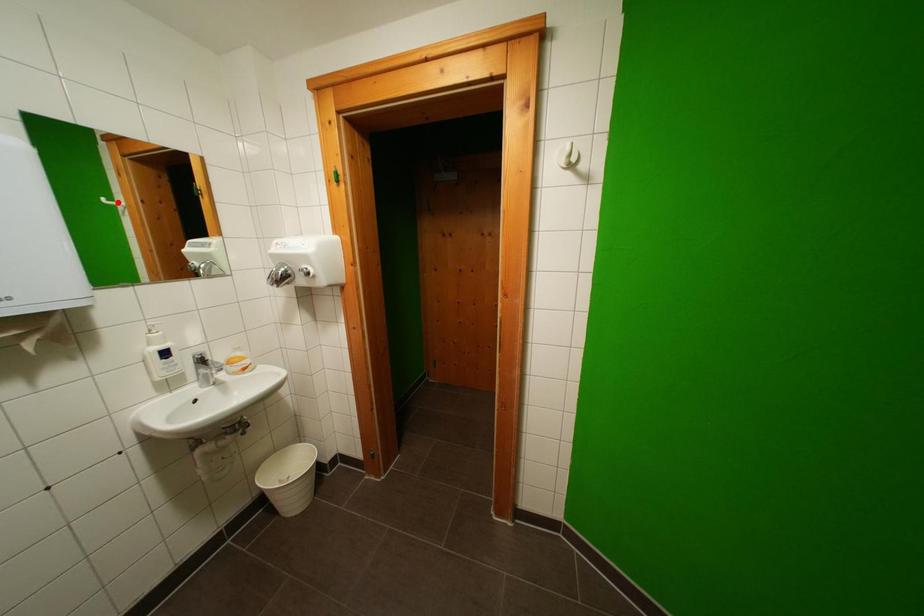
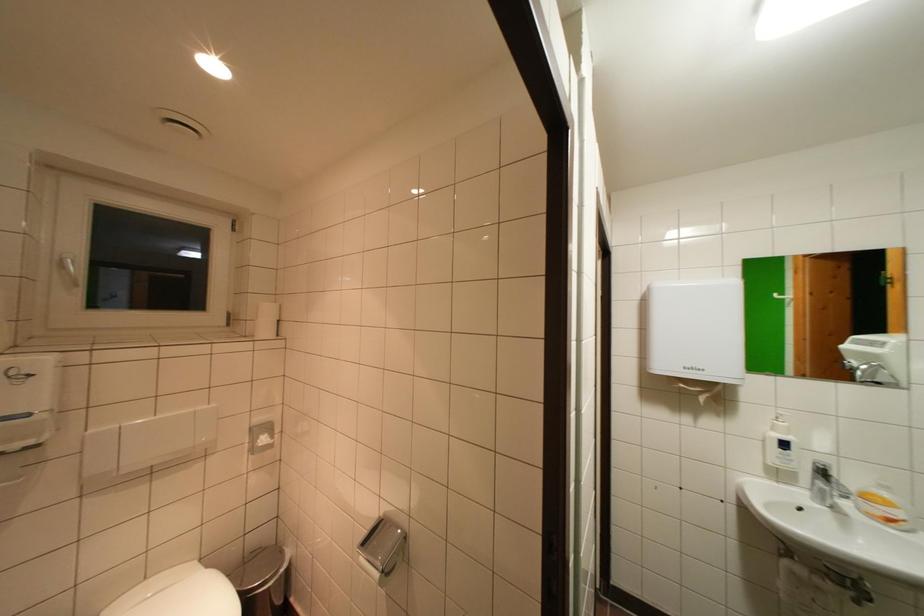
Where in the second image is the point corresponding to the highlighted location from the first image?

(788, 297)